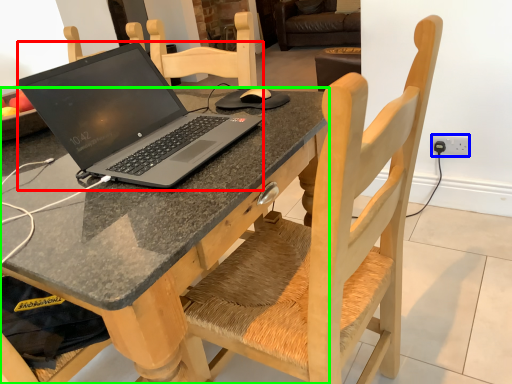
Question: Estimate the real-world distances between objects in this image. Which object is closer to laptop (highlighted by a red box), electric outlet (highlighted by a blue box) or desk (highlighted by a green box)?

Choices:
 (A) electric outlet
 (B) desk

Answer: (B)